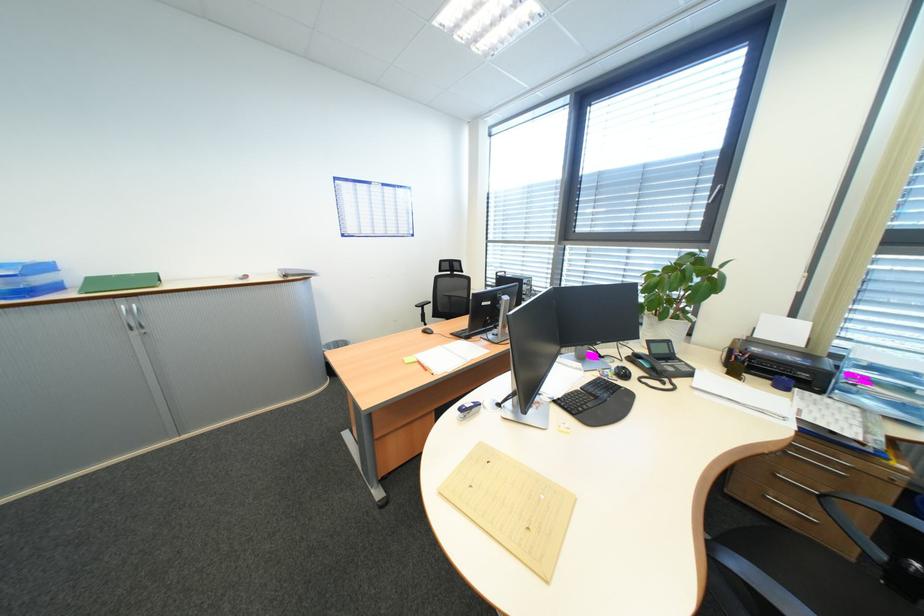
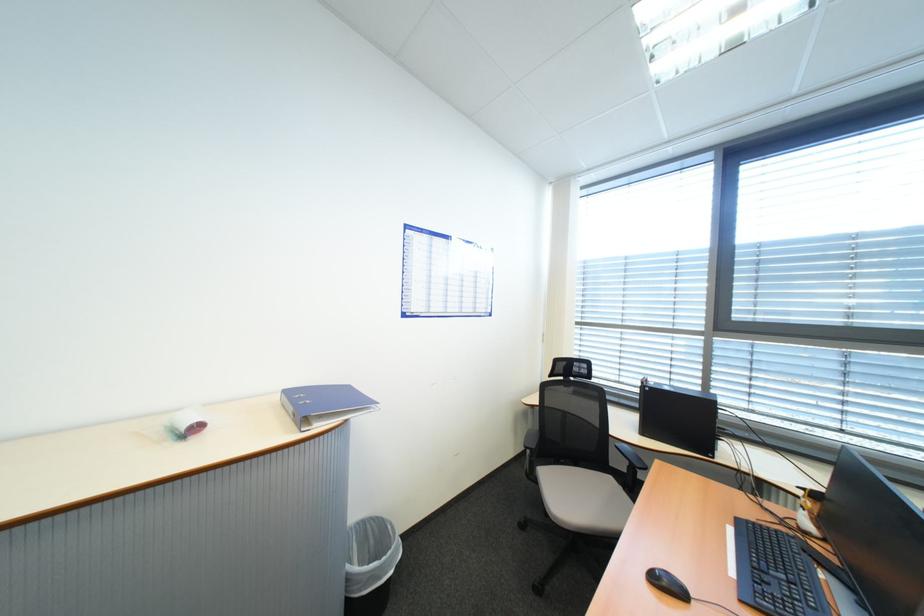
What movement of the cameraman would produce the second image?

The cameraman moved toward left, forward.